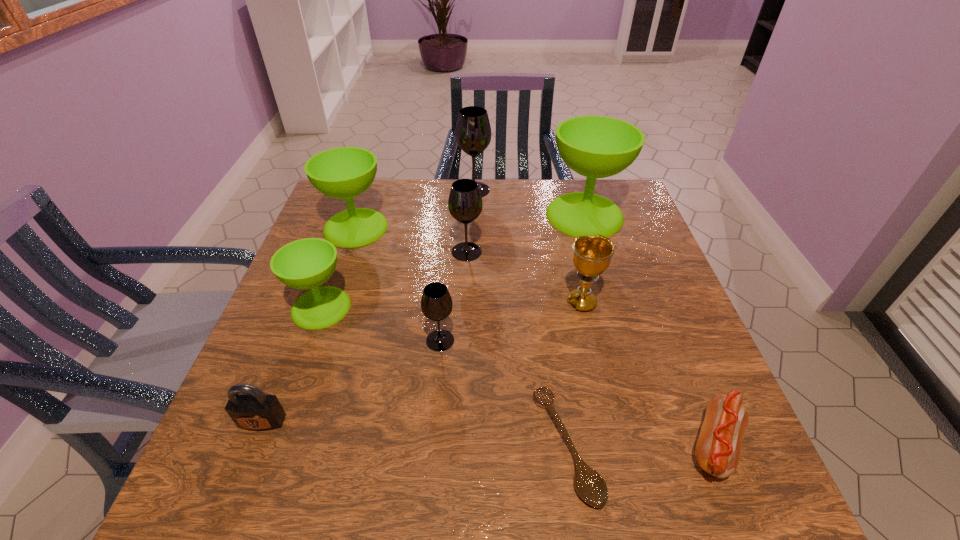
What are the coordinates of `brown sausage` in the screenshot? It's located at (718, 448).

The width and height of the screenshot is (960, 540). Identify the location of the ninth tallest object. (718, 448).

The width and height of the screenshot is (960, 540). In order to click on ladle in this screenshot , I will do `click(590, 486)`.

Where is `free space located on the front of the biggest gray wineglass`? The height and width of the screenshot is (540, 960). free space located on the front of the biggest gray wineglass is located at coordinates (473, 243).

Locate an element on the screen. vacant space located 0.400m on the left of the biggest green wineglass is located at coordinates (411, 215).

This screenshot has width=960, height=540. In order to click on vacant space situated on the back of the second biggest green wineglass in this screenshot , I will do `click(367, 197)`.

At what (x,y) coordinates should I click in order to perform the action: click on vacant space positioned 0.050m on the left of the second biggest gray wineglass. Please return your answer as a coordinate pair (x, y). Looking at the image, I should click on (432, 252).

Find the location of `vacant region located on the left of the gold chalice`. vacant region located on the left of the gold chalice is located at coordinates (428, 303).

Locate an element on the screen. The image size is (960, 540). blank space located 0.120m on the back of the nearest green wineglass is located at coordinates (340, 255).

Locate an element on the screen. Image resolution: width=960 pixels, height=540 pixels. vacant area situated 0.070m on the right of the smallest gray wineglass is located at coordinates (487, 340).